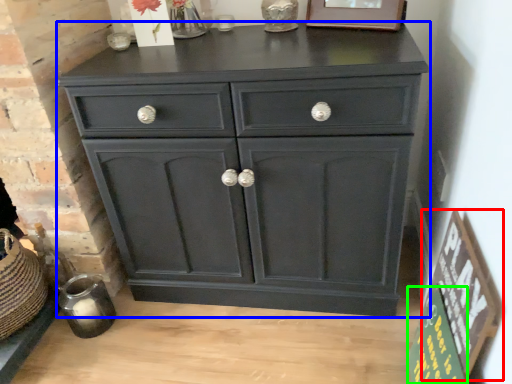
Question: Which object is positioned closest to bulletin board (highlighted by a red box)? Select from chest of drawers (highlighted by a blue box) and bulletin board (highlighted by a green box).

Choices:
 (A) chest of drawers
 (B) bulletin board

Answer: (B)